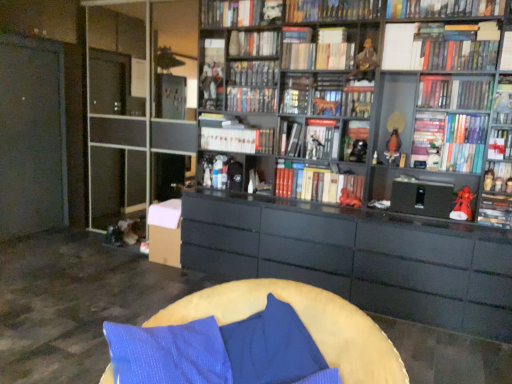
Question: Is white glossy book at upper right, the 16th book positioned from the top, taller or shorter than hardcover book at upper center, acting as the 1th book starting from the top?

Choices:
 (A) tall
 (B) short

Answer: (B)

Question: Based on their positions, is white glossy book at upper right, the 16th book positioned from the top, located to the left or right of hardcover book at upper center, arranged as the 19th book when ordered from the bottom?

Choices:
 (A) right
 (B) left

Answer: (A)

Question: Estimate the real-world distances between objects in this image. Which object is farther from the soft yellow cushion at lower center?

Choices:
 (A) blue fabric pillow at lower center
 (B) hardcover book at center, which is the thirteenth book from top to bottom
 (C) hardcover book at center, arranged as the 5th book when viewed from the top
 (D) hardcover book at upper right, which ranks as the fifteenth book in top-to-bottom order
 (E) matte black book at center, which appears as the sixth book when ordered from the bottom

Answer: (C)

Question: Based on their relative distances, which object is nearer to the hardcover book at center, the seventh book viewed from the top?

Choices:
 (A) hardcover book at upper right, which ranks as the fifteenth book in top-to-bottom order
 (B) blue fabric pillow at lower center
 (C) hardcover book at upper center, which is counted as the 16th book, starting from the bottom
 (D) soft yellow cushion at lower center
 (E) hardcover book at upper right, which is the eighth book in bottom-to-top order

Answer: (C)